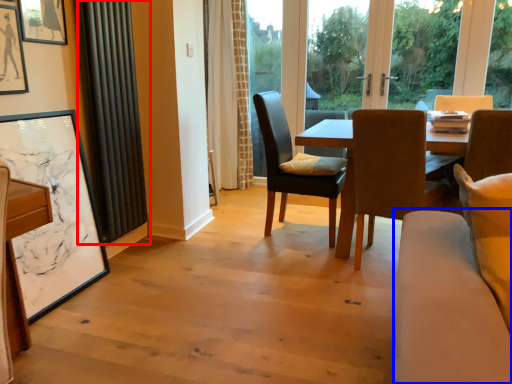
Question: Among these objects, which one is nearest to the camera, curtain (highlighted by a red box) or couch (highlighted by a blue box)?

Choices:
 (A) curtain
 (B) couch

Answer: (B)